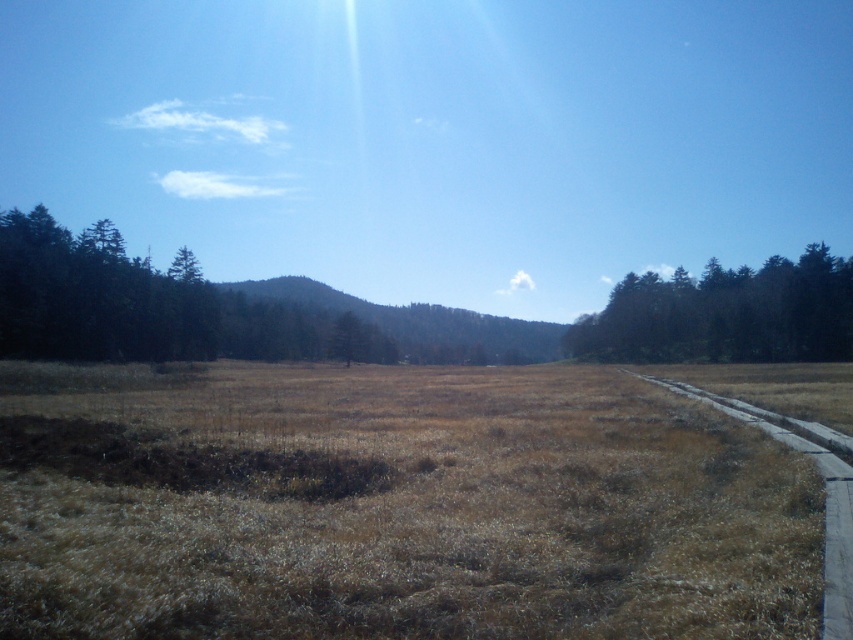
You are a hiker standing at the start of the gray concrete path at right. You want to reach a picnic spot located to the east of the green matte tree at right. Which direction should you walk along the path to reach the picnic spot?

Since the green matte tree at right is to the right of the gray concrete path at right, you should walk east along the path to reach the picnic spot east of the tree.

You are a hiker trying to cross the field. You notice the brown dry grass at center and the dark green textured trees at left. Which one is shorter?

The brown dry grass at center is shorter than the dark green textured trees at left.

You are a hiker carrying a 2 meter wide tent. You see the green matte tree at right and the gray concrete path at right. Can you set up your tent between them without overlapping either?

The green matte tree at right and gray concrete path at right are 66.80 meters apart from each other. Since your tent is only 2 meters wide, there is sufficient space to set it up between them without overlapping either.